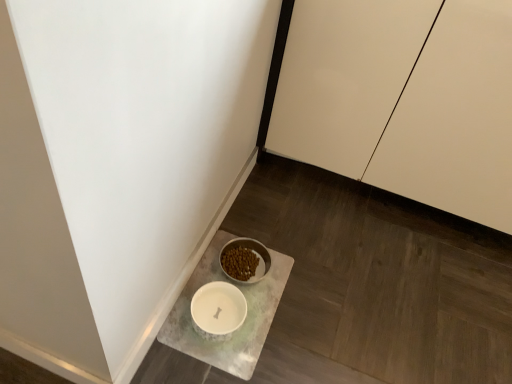
The image size is (512, 384). I want to click on vacant space to the right of white marble tray at lower center, so click(330, 308).